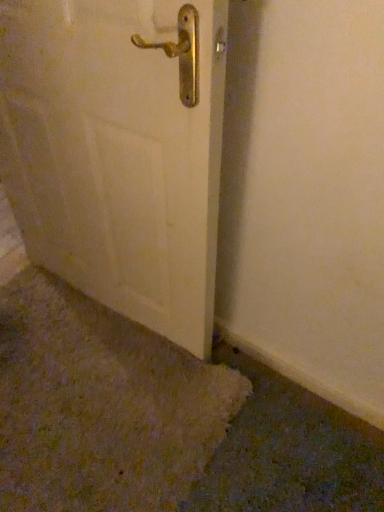
Image resolution: width=384 pixels, height=512 pixels. What do you see at coordinates (119, 151) in the screenshot?
I see `white matte door at center` at bounding box center [119, 151].

I want to click on white matte door at center, so click(x=119, y=151).

Where is `white matte door at center`? This screenshot has width=384, height=512. white matte door at center is located at coordinates (119, 151).